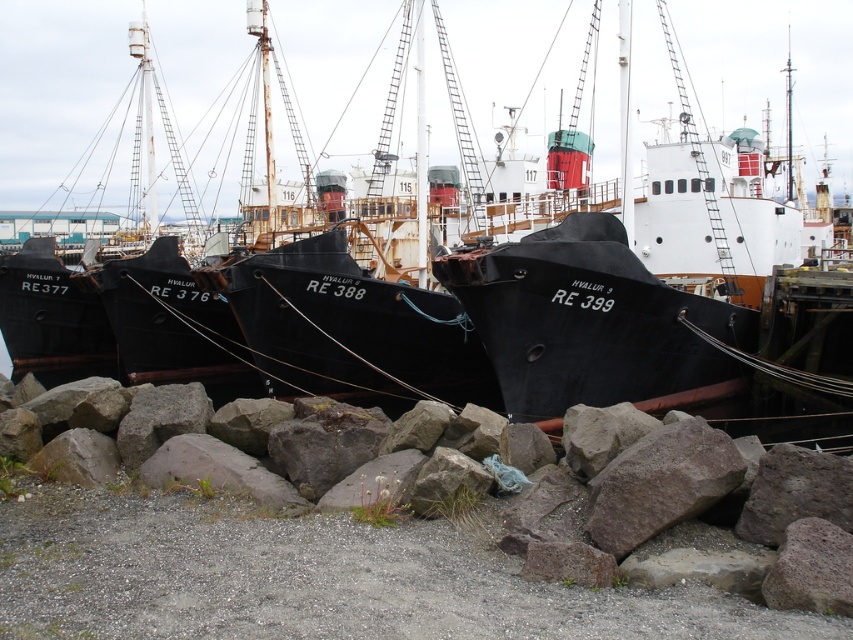
Question: Where is black matte boat at center located in relation to gray rough rock at lower center in the image?

Choices:
 (A) below
 (B) above

Answer: (B)

Question: Which point is closer to the camera?

Choices:
 (A) gray rough rock at lower center
 (B) black matte boat at center

Answer: (A)

Question: Is black matte boat at center above gray rough rock at lower center?

Choices:
 (A) yes
 (B) no

Answer: (A)

Question: Among these points, which one is nearest to the camera?

Choices:
 (A) (688, 497)
 (B) (53, 16)

Answer: (A)

Question: Does black matte boat at center have a lesser width compared to gray rough rock at lower center?

Choices:
 (A) yes
 (B) no

Answer: (B)